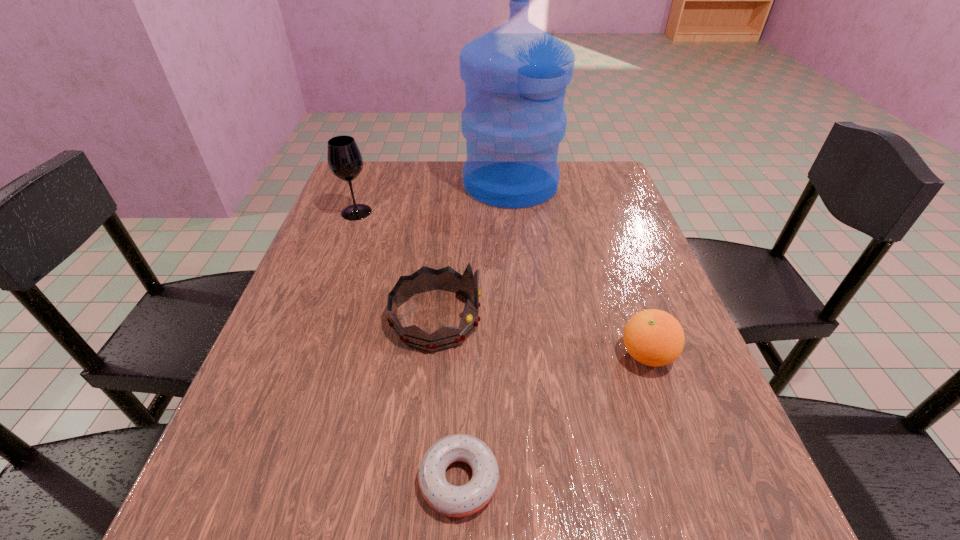
The height and width of the screenshot is (540, 960). What are the coordinates of `water jug` in the screenshot? It's located at (515, 75).

The width and height of the screenshot is (960, 540). Identify the location of wineglass. (345, 161).

The width and height of the screenshot is (960, 540). I want to click on the leftmost object, so click(x=345, y=161).

This screenshot has height=540, width=960. In order to click on the third shortest object in this screenshot , I will do `click(425, 279)`.

Where is `the rightmost object`? The width and height of the screenshot is (960, 540). the rightmost object is located at coordinates (653, 337).

Where is `the fourth tallest object`? This screenshot has width=960, height=540. the fourth tallest object is located at coordinates (653, 337).

Where is `doughnut`? This screenshot has height=540, width=960. doughnut is located at coordinates [454, 501].

Where is `the nearest object`? The width and height of the screenshot is (960, 540). the nearest object is located at coordinates (454, 501).

Locate an element on the screen. vacant space situated on the left of the tallest object is located at coordinates (419, 184).

Identify the location of free space located 0.070m on the back of the wineglass. (365, 190).